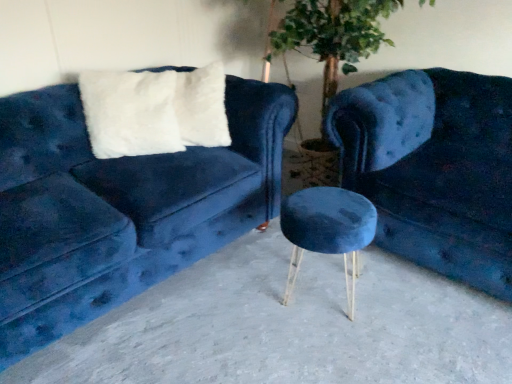
Where is `free space in front of velvet blue stool at center`? The height and width of the screenshot is (384, 512). free space in front of velvet blue stool at center is located at coordinates (334, 341).